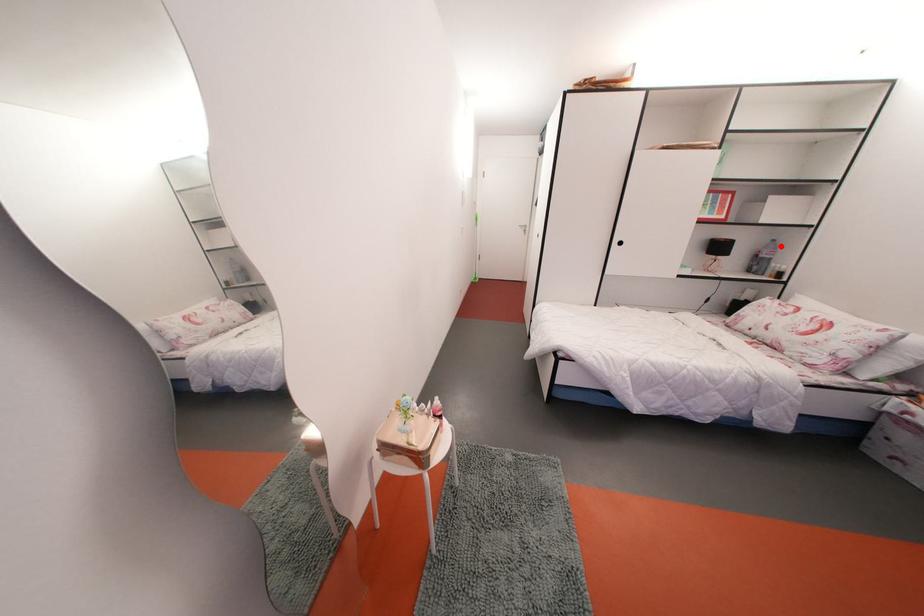
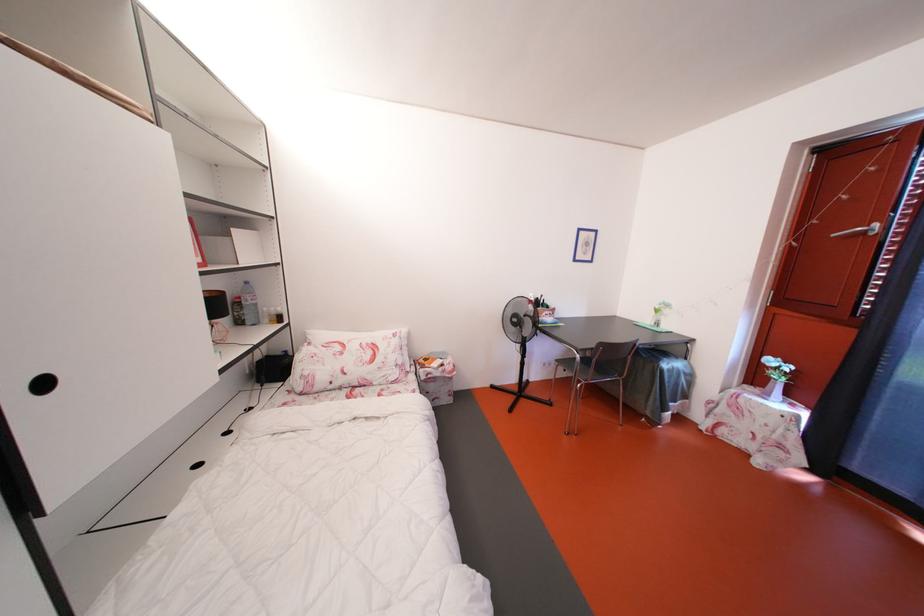
Question: A red point is marked in image1. In image2, is the corresponding 3D point closer to the camera or farther? Reply with the corresponding letter.

Choices:
 (A) The corresponding 3D point is closer.
 (B) The corresponding 3D point is farther.

Answer: (A)